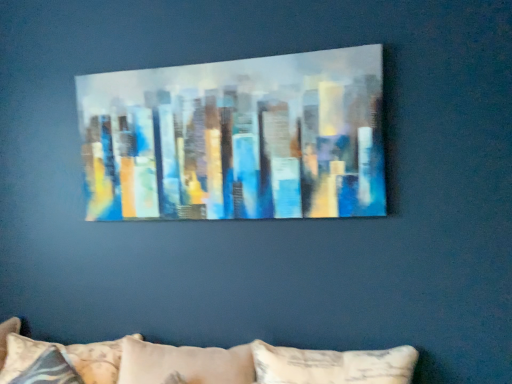
The width and height of the screenshot is (512, 384). Describe the element at coordinates (66, 357) in the screenshot. I see `patterned fabric pillow at lower left` at that location.

Locate an element on the screen. Image resolution: width=512 pixels, height=384 pixels. patterned fabric pillow at lower left is located at coordinates (66, 357).

What do you see at coordinates (236, 138) in the screenshot? I see `painted canvas cityscape at center` at bounding box center [236, 138].

I want to click on painted canvas cityscape at center, so click(x=236, y=138).

Where is `patterned fabric pillow at lower left`? The image size is (512, 384). patterned fabric pillow at lower left is located at coordinates (66, 357).

Which object is positioned more to the left, patterned fabric pillow at lower left or painted canvas cityscape at center?

Positioned to the left is patterned fabric pillow at lower left.

Which object is closer to the camera, patterned fabric pillow at lower left or painted canvas cityscape at center?

painted canvas cityscape at center is closer to the camera.

Does point (36, 344) appear closer or farther from the camera than point (230, 193)?

Point (36, 344).

From the image's perspective, which is above, patterned fabric pillow at lower left or painted canvas cityscape at center?

From the image's view, painted canvas cityscape at center is above.

From a real-world perspective, is patterned fabric pillow at lower left positioned over painted canvas cityscape at center based on gravity?

No, from a real-world perspective, patterned fabric pillow at lower left is not on top of painted canvas cityscape at center.

Is patterned fabric pillow at lower left thinner than painted canvas cityscape at center?

In fact, patterned fabric pillow at lower left might be wider than painted canvas cityscape at center.

Considering the sizes of objects patterned fabric pillow at lower left and painted canvas cityscape at center in the image provided, who is shorter, patterned fabric pillow at lower left or painted canvas cityscape at center?

patterned fabric pillow at lower left.

Based on their sizes in the image, would you say patterned fabric pillow at lower left is bigger or smaller than painted canvas cityscape at center?

patterned fabric pillow at lower left is bigger than painted canvas cityscape at center.

Is patterned fabric pillow at lower left not within painted canvas cityscape at center?

Yes, patterned fabric pillow at lower left is located beyond the bounds of painted canvas cityscape at center.

Is patterned fabric pillow at lower left with painted canvas cityscape at center?

No, patterned fabric pillow at lower left is not in contact with painted canvas cityscape at center.

Is patterned fabric pillow at lower left facing away from painted canvas cityscape at center?

No, painted canvas cityscape at center is not at the back of patterned fabric pillow at lower left.

Where is `picture frame above the patterned fabric pillow at lower left (from a real-world perspective)`? The image size is (512, 384). picture frame above the patterned fabric pillow at lower left (from a real-world perspective) is located at coordinates (236, 138).

From the picture: Considering the positions of objects painted canvas cityscape at center and patterned fabric pillow at lower left in the image provided, who is more to the left, painted canvas cityscape at center or patterned fabric pillow at lower left?

Positioned to the left is patterned fabric pillow at lower left.

Between painted canvas cityscape at center and patterned fabric pillow at lower left, which one is positioned behind?

patterned fabric pillow at lower left is further away from the camera.

Is point (272, 190) farther from camera compared to point (94, 344)?

No, it is in front of (94, 344).

From the image's perspective, which object appears higher, painted canvas cityscape at center or patterned fabric pillow at lower left?

painted canvas cityscape at center appears higher in the image.

From a real-world perspective, is painted canvas cityscape at center above or below patterned fabric pillow at lower left?

painted canvas cityscape at center is situated higher than patterned fabric pillow at lower left in the real world.

Considering the relative sizes of painted canvas cityscape at center and patterned fabric pillow at lower left in the image provided, is painted canvas cityscape at center thinner than patterned fabric pillow at lower left?

Yes.

Based on the photo, from their relative heights in the image, would you say painted canvas cityscape at center is taller or shorter than patterned fabric pillow at lower left?

Considering their sizes, painted canvas cityscape at center has more height than patterned fabric pillow at lower left.

Considering the sizes of objects painted canvas cityscape at center and patterned fabric pillow at lower left in the image provided, who is smaller, painted canvas cityscape at center or patterned fabric pillow at lower left?

painted canvas cityscape at center.

Is painted canvas cityscape at center not within patterned fabric pillow at lower left?

Absolutely, painted canvas cityscape at center is external to patterned fabric pillow at lower left.

Is painted canvas cityscape at center not close to patterned fabric pillow at lower left?

painted canvas cityscape at center is near patterned fabric pillow at lower left, not far away.

Is painted canvas cityscape at center looking in the opposite direction of patterned fabric pillow at lower left?

That's not correct — painted canvas cityscape at center is not looking away from patterned fabric pillow at lower left.

Looking at this image, how much distance is there between painted canvas cityscape at center and patterned fabric pillow at lower left?

painted canvas cityscape at center is 33.92 inches away from patterned fabric pillow at lower left.

Find the location of a particular element. Image resolution: width=512 pixels, height=384 pixels. pillow beneath the painted canvas cityscape at center (from a real-world perspective) is located at coordinates (66, 357).

I want to click on pillow behind the painted canvas cityscape at center, so click(66, 357).

Identify the location of picture frame that appears above the patterned fabric pillow at lower left (from a real-world perspective). The image size is (512, 384). (236, 138).